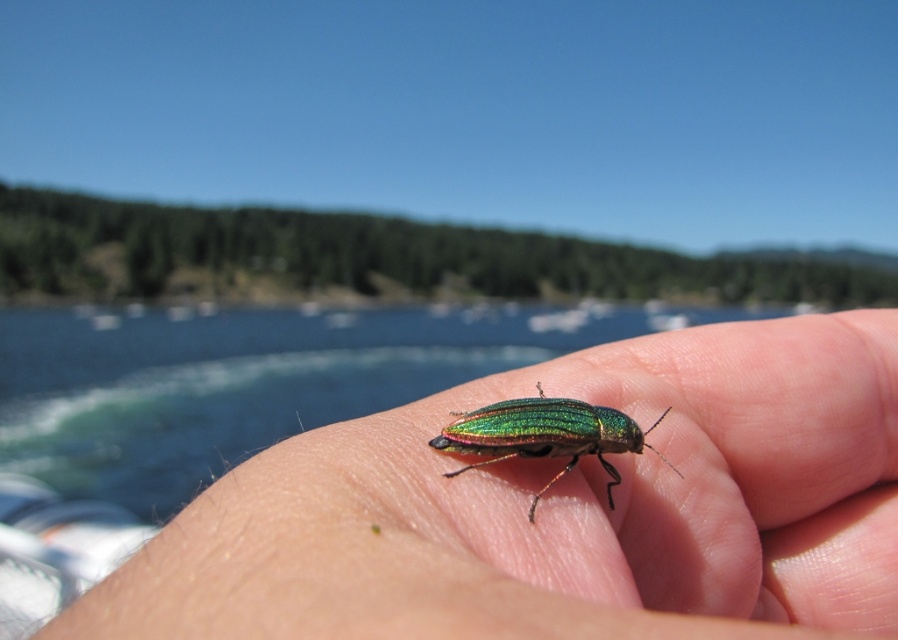
Question: Does metallic green beetle at center have a smaller size compared to metallic iridescent beetle at center?

Choices:
 (A) yes
 (B) no

Answer: (B)

Question: Is metallic green beetle at center below metallic iridescent beetle at center?

Choices:
 (A) no
 (B) yes

Answer: (B)

Question: Is metallic green beetle at center to the right of metallic iridescent beetle at center from the viewer's perspective?

Choices:
 (A) no
 (B) yes

Answer: (B)

Question: Which point appears farthest from the camera in this image?

Choices:
 (A) (507, 410)
 (B) (271, 541)

Answer: (A)